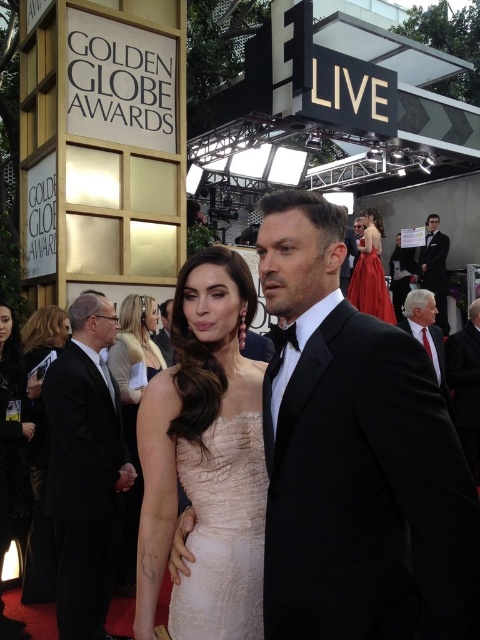
In the scene shown: Can you confirm if ivory lace dress at center is bigger than black leather dress at lower left?

Actually, ivory lace dress at center might be smaller than black leather dress at lower left.

Is point (250, 534) farther from camera compared to point (7, 413)?

No, (250, 534) is in front of (7, 413).

You are a GUI agent. You are given a task and a screenshot of the screen. Output one action in this format:
    pyautogui.click(x=<x>, y=<y>)
    Task: Click on the ivory lace dress at center
    This screenshot has width=480, height=640.
    Given the screenshot: What is the action you would take?
    pyautogui.click(x=223, y=532)

Image resolution: width=480 pixels, height=640 pixels. Describe the element at coordinates (466, 385) in the screenshot. I see `black satin suit at right` at that location.

Can you confirm if black satin suit at right is taller than white textured suit at right?

Yes, black satin suit at right is taller than white textured suit at right.

You are a GUI agent. You are given a task and a screenshot of the screen. Output one action in this format:
    pyautogui.click(x=<x>, y=<y>)
    Task: Click on the black satin suit at right
    
    Given the screenshot: What is the action you would take?
    pyautogui.click(x=466, y=385)

Who is shorter, black satin tuxedo at center or black satin suit at right?

With less height is black satin suit at right.

Which is more to the left, black satin tuxedo at center or black satin suit at right?

From the viewer's perspective, black satin tuxedo at center appears more on the left side.

What do you see at coordinates (356, 458) in the screenshot? I see `black satin tuxedo at center` at bounding box center [356, 458].

Image resolution: width=480 pixels, height=640 pixels. Find the location of `black satin tuxedo at center`. black satin tuxedo at center is located at coordinates (356, 458).